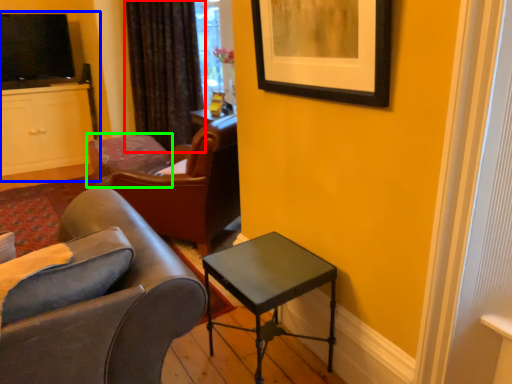
Question: Based on their relative distances, which object is farther from curtain (highlighted by a red box)? Choose from entertainment center (highlighted by a blue box) and chair (highlighted by a green box).

Choices:
 (A) entertainment center
 (B) chair

Answer: (A)